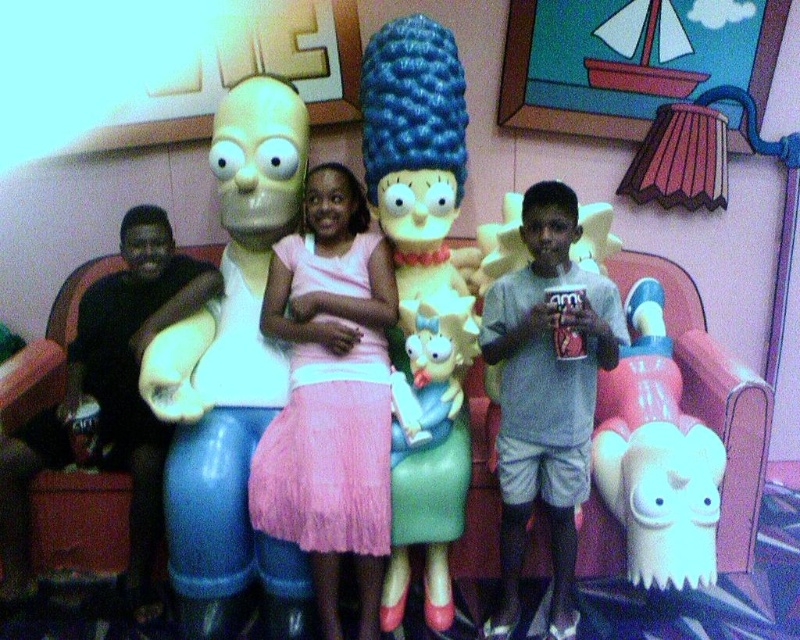
Does smooth plastic doll at center have a lesser width compared to gray cotton shirt at center?

Indeed, smooth plastic doll at center has a lesser width compared to gray cotton shirt at center.

Is smooth plastic doll at center to the right of gray cotton shirt at center from the viewer's perspective?

In fact, smooth plastic doll at center is to the left of gray cotton shirt at center.

What do you see at coordinates (421, 285) in the screenshot? I see `smooth plastic doll at center` at bounding box center [421, 285].

Locate an element on the screen. The image size is (800, 640). smooth plastic doll at center is located at coordinates (421, 285).

Which is below, pink tulle skirt at center or white matte toy at lower right?

Positioned lower is white matte toy at lower right.

Who is more forward, (252, 513) or (721, 444)?

Positioned in front is point (252, 513).

Identify the location of pink tulle skirt at center. This screenshot has height=640, width=800. (330, 396).

Which is below, gray cotton shirt at center or white matte toy at lower right?

white matte toy at lower right is lower down.

Does gray cotton shirt at center appear over white matte toy at lower right?

Yes.

Is point (550, 352) farther from camera compared to point (714, 572)?

No.

Where is `gray cotton shirt at center`? The image size is (800, 640). gray cotton shirt at center is located at coordinates (546, 394).